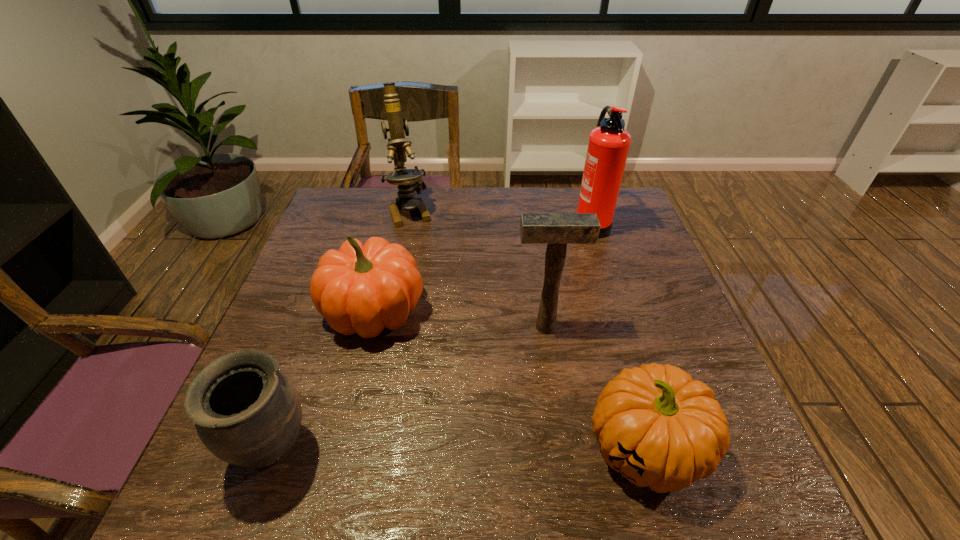
Where is `fire extinguisher`? fire extinguisher is located at coordinates (608, 146).

Locate an element on the screen. Image resolution: width=960 pixels, height=540 pixels. microscope is located at coordinates (409, 182).

Image resolution: width=960 pixels, height=540 pixels. What are the coordinates of `mallet` in the screenshot? It's located at (556, 230).

Identify the location of the farther pumpkin. The image size is (960, 540). (361, 289).

The height and width of the screenshot is (540, 960). In order to click on the taller pumpkin in this screenshot , I will do `click(361, 289)`.

The image size is (960, 540). I want to click on urn, so click(247, 412).

Locate an element on the screen. the nearer pumpkin is located at coordinates (659, 428).

This screenshot has height=540, width=960. I want to click on the right pumpkin, so click(659, 428).

Identify the location of vacant area located at the nozzle of the fire extinguisher. The height and width of the screenshot is (540, 960). (447, 223).

Image resolution: width=960 pixels, height=540 pixels. In order to click on vacant space situated at the nozzle of the fire extinguisher in this screenshot , I will do (454, 223).